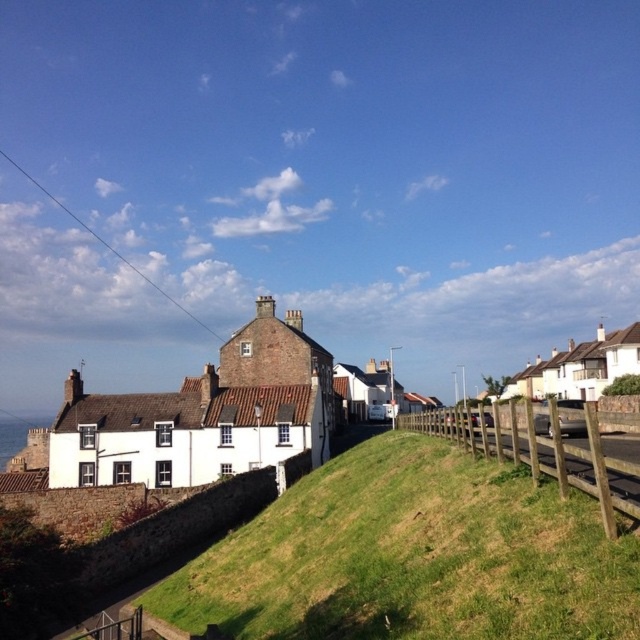
Is green grassy hillside at lower center to the right of wooden fence at lower right from the viewer's perspective?

In fact, green grassy hillside at lower center is to the left of wooden fence at lower right.

Looking at this image, who is lower down, green grassy hillside at lower center or wooden fence at lower right?

green grassy hillside at lower center

Who is more distant from viewer, (214, 577) or (614, 461)?

Point (214, 577)

Find the location of `green grassy hillside at lower center`. green grassy hillside at lower center is located at coordinates 412,556.